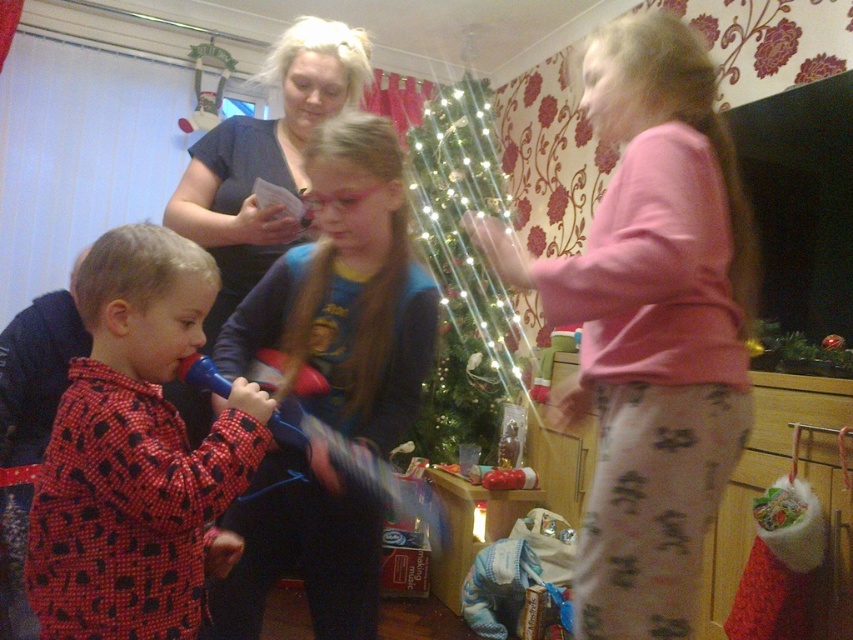
Question: Which point appears closest to the camera in this image?

Choices:
 (A) (698, 333)
 (B) (375, 152)

Answer: (A)

Question: Does pink cotton pajamas at upper right appear over green shiny christmas tree at center?

Choices:
 (A) no
 (B) yes

Answer: (A)

Question: Is red dotted pajamas at left further to camera compared to blue cotton shirt at center?

Choices:
 (A) yes
 (B) no

Answer: (B)

Question: Which point appears farthest from the camera in this image?

Choices:
 (A) (412, 417)
 (B) (444, 129)

Answer: (B)

Question: Which is nearer to the blue cotton shirt at center?

Choices:
 (A) pink cotton pajamas at upper right
 (B) red dotted pajamas at left
 (C) green shiny christmas tree at center

Answer: (B)

Question: Does red dotted pajamas at left appear on the right side of blue cotton shirt at center?

Choices:
 (A) yes
 (B) no

Answer: (B)